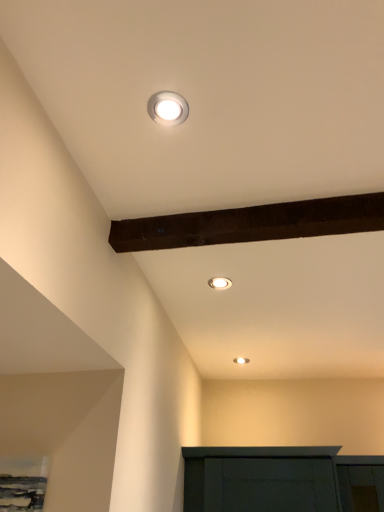
Question: Do you think white glossy light fixture at upper center, the third lamp viewed from the top, is within matte white recessed light at center, the second lamp viewed from the left, or outside of it?

Choices:
 (A) inside
 (B) outside

Answer: (B)

Question: From a real-world perspective, is white glossy light fixture at upper center, which appears as the 1th lamp when ordered from the bottom, above or below matte white recessed light at center, placed as the second lamp when sorted from front to back?

Choices:
 (A) above
 (B) below

Answer: (B)

Question: Which object is the farthest from the matte white recessed light at center, the 2th lamp viewed from the right?

Choices:
 (A) white glossy light fixture at upper center, which is the 3th lamp in left-to-right order
 (B) white glossy light fixture at upper center, the 3th lamp positioned from the right

Answer: (A)

Question: Estimate the real-world distances between objects in this image. Which object is closer to the white glossy light fixture at upper center, acting as the first lamp starting from the left?

Choices:
 (A) white glossy light fixture at upper center, which appears as the 1th lamp when ordered from the bottom
 (B) matte white recessed light at center, which is the second lamp from back to front

Answer: (B)